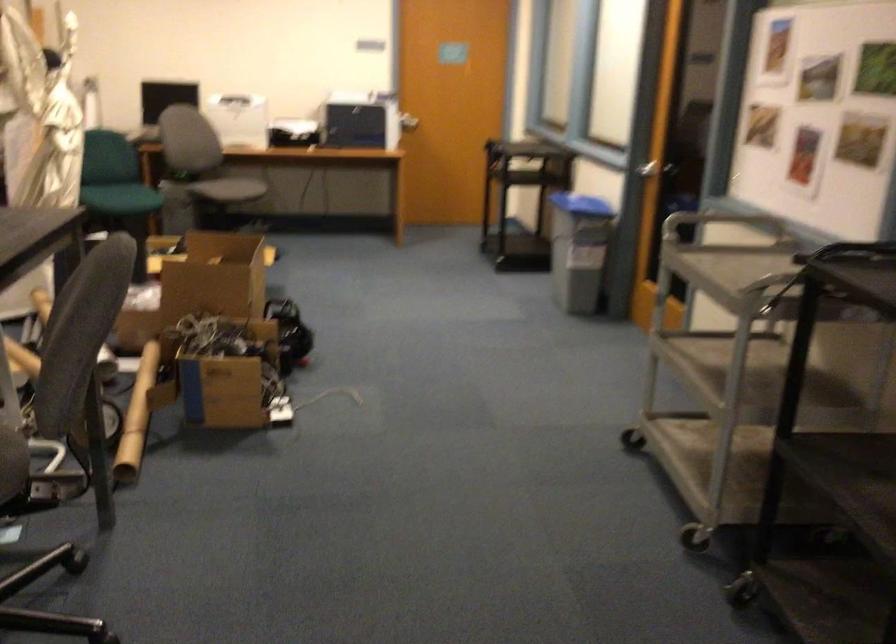
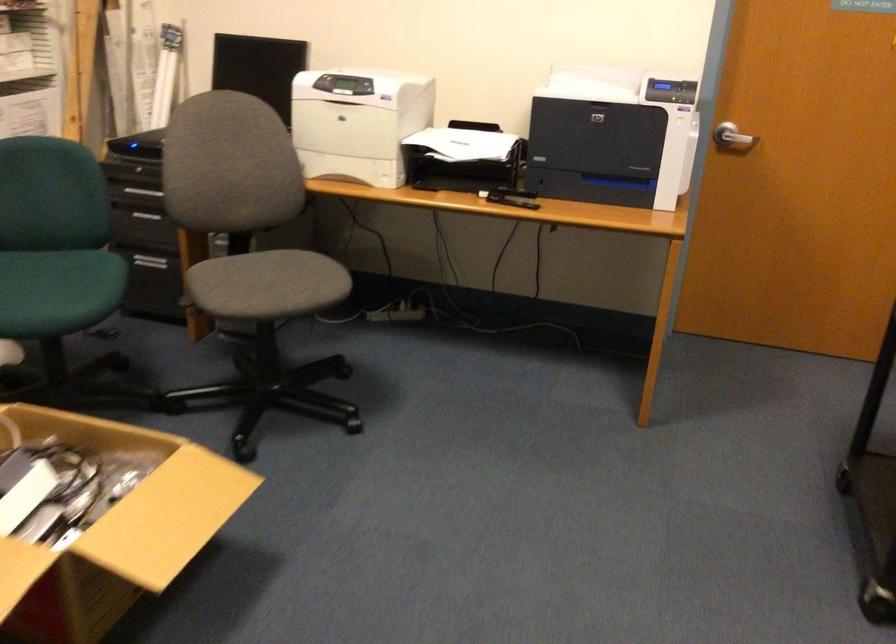
Question: What movement of the cameraman would produce the second image?

Choices:
 (A) Left
 (B) Right
 (C) Forward
 (D) Backward

Answer: (C)